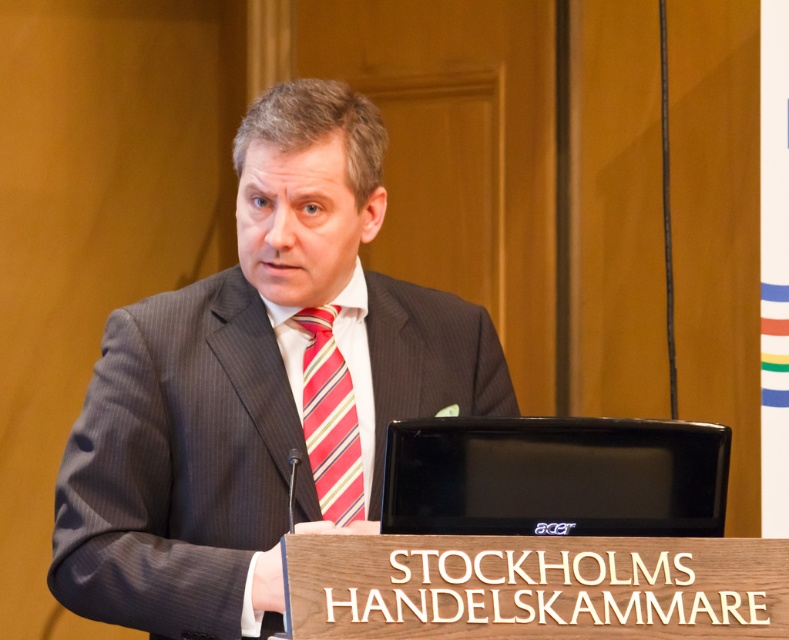
Does dark gray pinstripe suit at center lie in front of striped fabric tie at center?

Yes, dark gray pinstripe suit at center is in front of striped fabric tie at center.

Which is in front, point (335, 246) or point (309, 381)?

Point (335, 246) is more forward.

Which is in front, point (113, 604) or point (322, 515)?

Point (113, 604)

The image size is (789, 640). Find the location of `dark gray pinstripe suit at center`. dark gray pinstripe suit at center is located at coordinates (260, 387).